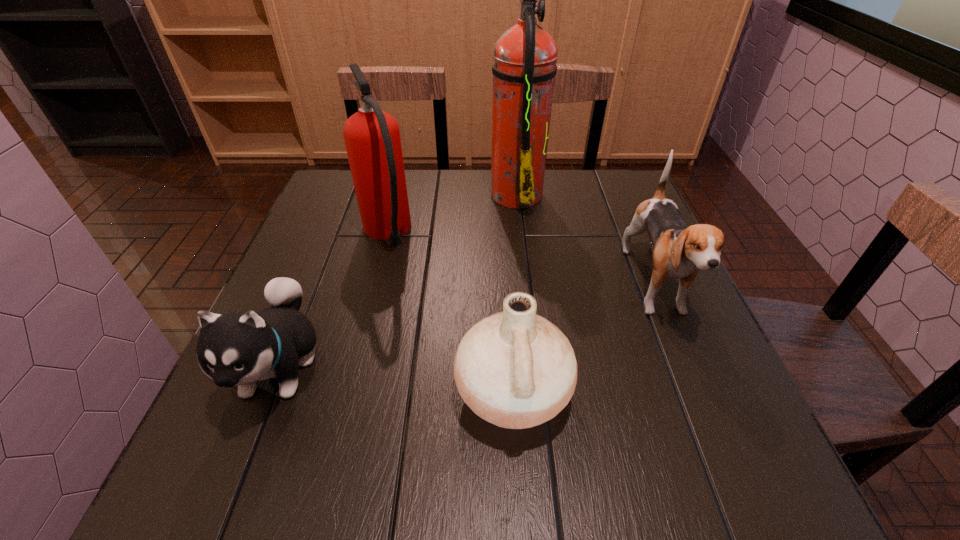
The width and height of the screenshot is (960, 540). I want to click on vacant area at the near left corner of the desktop, so click(x=257, y=457).

In the image, there is a desktop. At what (x,y) coordinates should I click in order to perform the action: click on free space at the near right corner. Please return your answer as a coordinate pair (x, y). The image size is (960, 540). Looking at the image, I should click on (711, 484).

This screenshot has height=540, width=960. I want to click on free space between the shorter fire extinguisher and the pottery, so click(x=450, y=313).

Locate an element on the screen. The width and height of the screenshot is (960, 540). vacant area that lies between the taller puppy and the taller fire extinguisher is located at coordinates (586, 240).

The image size is (960, 540). I want to click on empty location between the shorter puppy and the taller fire extinguisher, so click(x=398, y=279).

Locate an element on the screen. Image resolution: width=960 pixels, height=540 pixels. empty location between the pottery and the left fire extinguisher is located at coordinates (450, 313).

The width and height of the screenshot is (960, 540). What are the coordinates of `free space between the leftmost object and the tallest object` in the screenshot? It's located at (398, 279).

Where is `vacant area that lies between the third shortest object and the pottery`? The width and height of the screenshot is (960, 540). vacant area that lies between the third shortest object and the pottery is located at coordinates (584, 340).

Identify the location of vacant space that's between the left fire extinguisher and the pottery. The image size is (960, 540). (450, 313).

Image resolution: width=960 pixels, height=540 pixels. Identify the location of blank region between the fourth shortest object and the pottery. (450, 313).